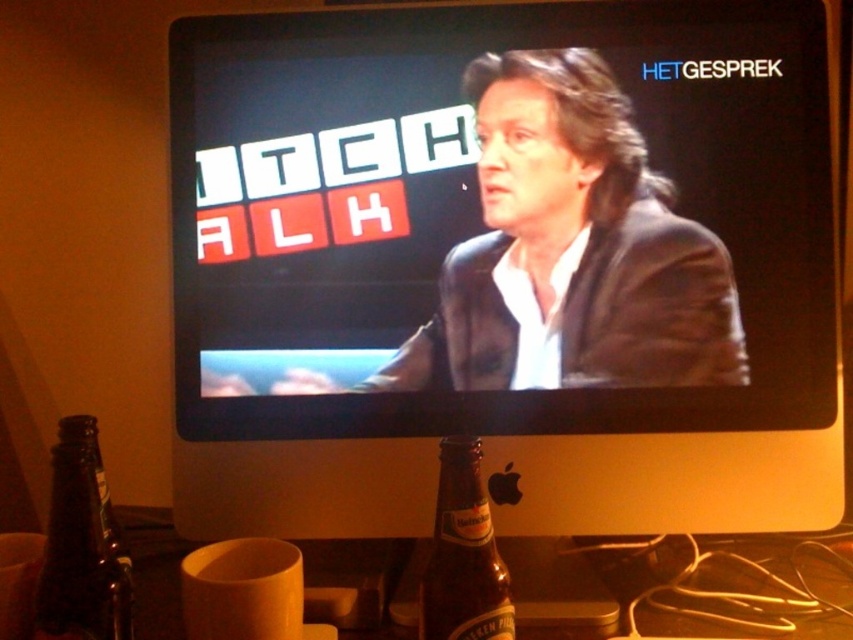
Question: Based on their relative distances, which object is farther from the brown glass bottle at lower center?

Choices:
 (A) black glossy computer monitor at center
 (B) brown glass bottle at lower left

Answer: (A)

Question: Which object appears closest to the camera in this image?

Choices:
 (A) brown glass bottle at lower left
 (B) black glossy computer monitor at center
 (C) brown glass bottle at lower center

Answer: (C)

Question: Is black glossy computer monitor at center positioned at the back of brown glass bottle at lower center?

Choices:
 (A) yes
 (B) no

Answer: (A)

Question: Can you confirm if black glossy computer monitor at center is positioned to the right of brown glass bottle at lower center?

Choices:
 (A) no
 (B) yes

Answer: (B)

Question: Which of the following is the farthest from the observer?

Choices:
 (A) black glossy computer monitor at center
 (B) brown glass bottle at lower center

Answer: (A)

Question: Can you confirm if black glossy computer monitor at center is positioned to the left of brown glass bottle at lower center?

Choices:
 (A) yes
 (B) no

Answer: (B)